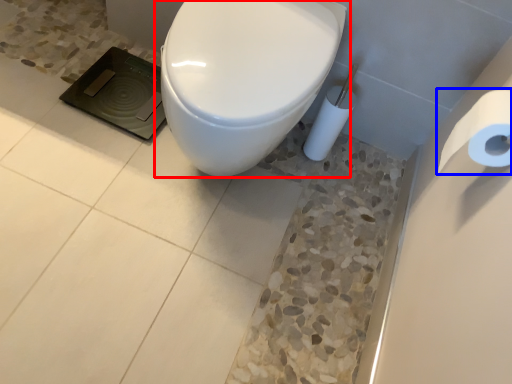
Question: Which of the following is the closest to the observer, toilet (highlighted by a red box) or toilet paper (highlighted by a blue box)?

Choices:
 (A) toilet
 (B) toilet paper

Answer: (B)